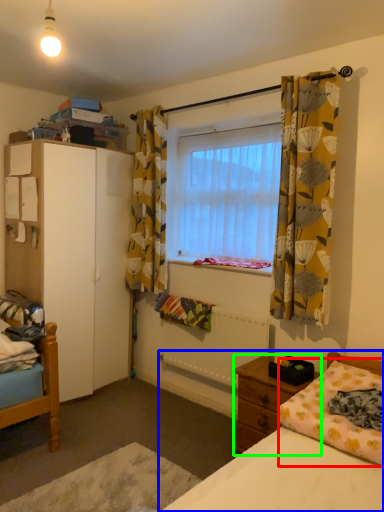
Question: Which object is the closest to the mattress (highlighted by a red box)? Choose among these: bed (highlighted by a blue box) or nightstand (highlighted by a green box).

Choices:
 (A) bed
 (B) nightstand

Answer: (A)